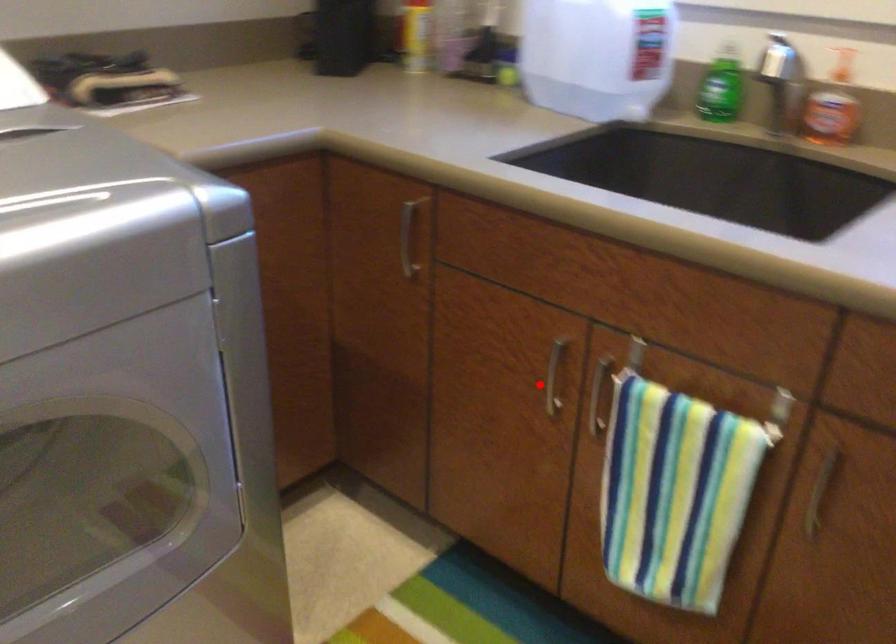
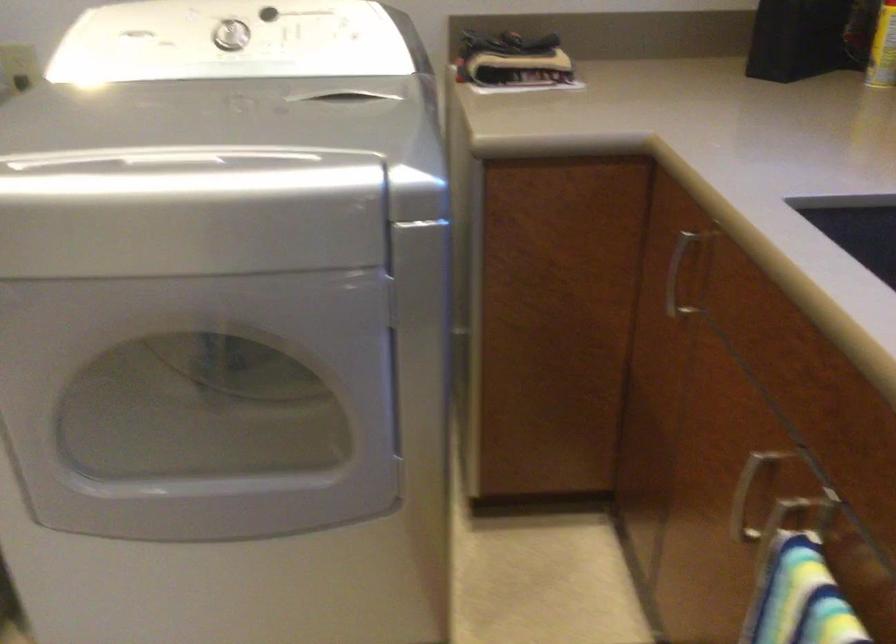
Locate, in the second image, the point that corresponds to the highlighted location in the first image.

(745, 497)